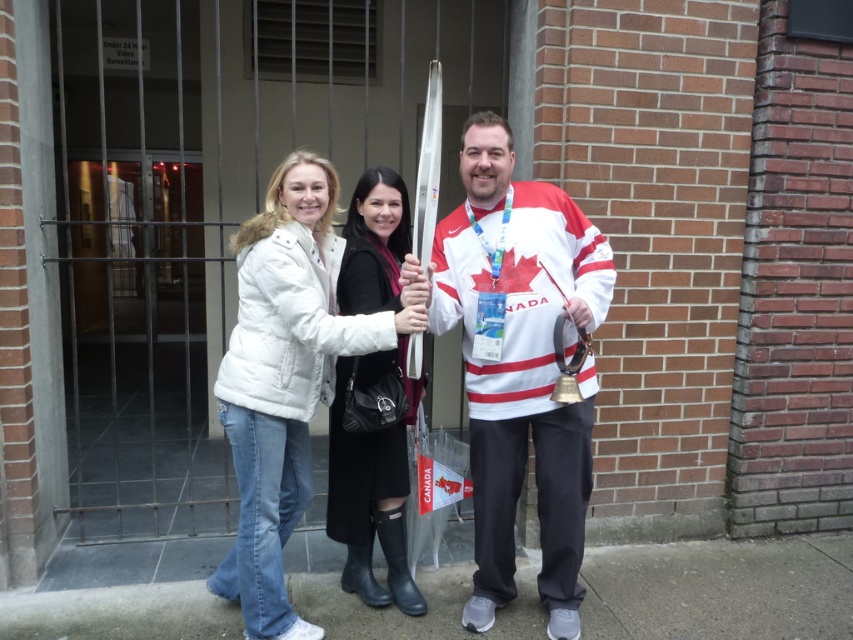
Question: Which of these objects is positioned farthest from the black leather boots at center?

Choices:
 (A) white fleece jacket at center
 (B) white matte jacket at center

Answer: (B)

Question: Which object is positioned farthest from the white fleece jacket at center?

Choices:
 (A) black leather boots at center
 (B) white jersey at center
 (C) white matte jacket at center

Answer: (B)

Question: Does white matte jacket at center appear over white fleece jacket at center?

Choices:
 (A) no
 (B) yes

Answer: (B)

Question: Is white jersey at center thinner than black leather boots at center?

Choices:
 (A) yes
 (B) no

Answer: (B)

Question: Estimate the real-world distances between objects in this image. Which object is farther from the black leather boots at center?

Choices:
 (A) white jersey at center
 (B) white fleece jacket at center
 (C) white matte jacket at center

Answer: (A)

Question: In this image, where is white matte jacket at center located relative to white fleece jacket at center?

Choices:
 (A) right
 (B) left

Answer: (A)